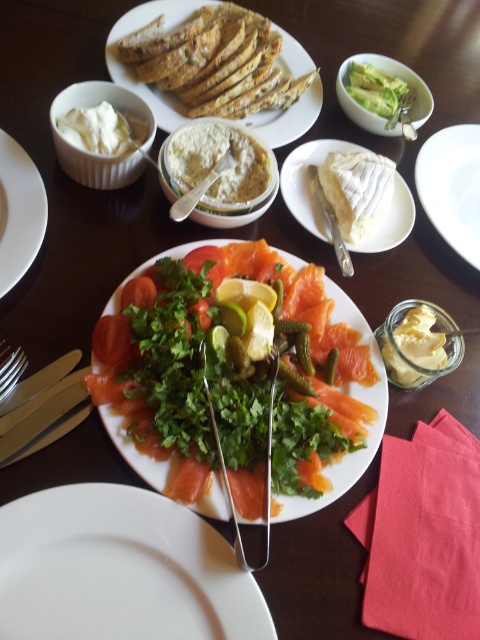
You are a guest at a dinner party and want to reach for the silvermetallicknife at right to cut the smoked salmon on the white matte plate at upper left. Is the knife within easy reach from the plate?

The white matte plate at upper left is in front of the silvermetallicknife at right, so the knife is positioned behind the plate. This means the knife would not be easily reachable from the plate without moving the plate or reaching around it.

You are a photographer setting up a shot for the meal. You want to capture the white matte plate at upper right in focus while keeping the background slightly blurred. If your camera has a depth of field setting that can blur objects beyond 30 inches away, will the background be sufficiently blurred when focusing on the plate?

The white matte plate at upper right is 35.69 inches away from the camera. Since the depth of field setting blurs objects beyond 30 inches, focusing on the plate at 35.69 inches would place it beyond the 30 inch threshold. This means the background will be sufficiently blurred when focusing on the white matte plate at upper right.

You are a chef arranging a meal on a table. You have a brown crusty bread at upper center and a white matte plate at upper right. Which object takes up more horizontal space on the table?

The brown crusty bread at upper center takes up more horizontal space on the table than the white matte plate at upper right because its width surpasses that of the white matte plate at upper right.